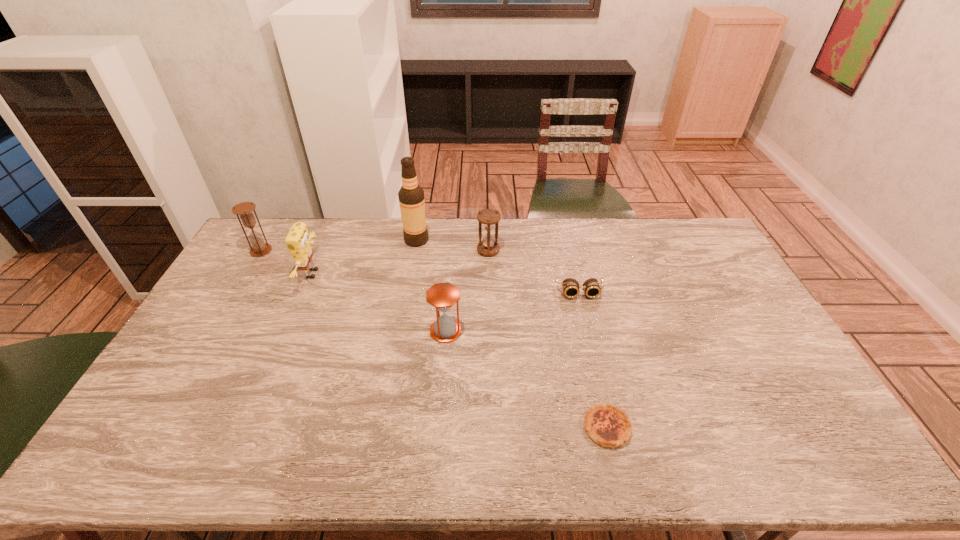
Find the location of `vacant area in the image that satisfies the following two spatial constraints: 1. on the back side of the shortest object; 2. on the label of the tallest object`. vacant area in the image that satisfies the following two spatial constraints: 1. on the back side of the shortest object; 2. on the label of the tallest object is located at coordinates (564, 240).

The image size is (960, 540). I want to click on free point that satisfies the following two spatial constraints: 1. on the face of the sponge; 2. on the left side of the nearest hourglass, so click(289, 331).

This screenshot has height=540, width=960. In order to click on free point that satisfies the following two spatial constraints: 1. on the back side of the fifth object from left to right; 2. on the left side of the nearest hourglass in this screenshot , I will do `click(451, 251)`.